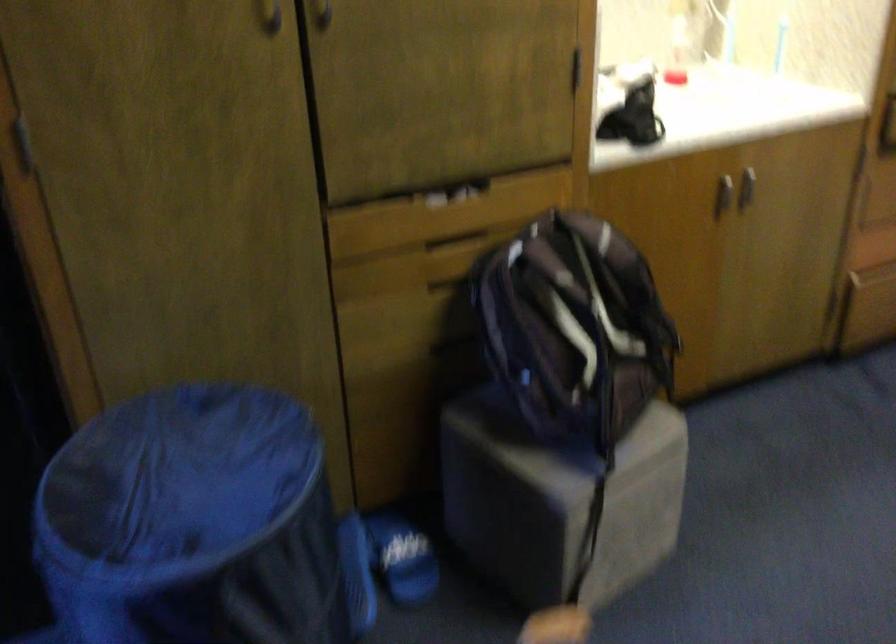
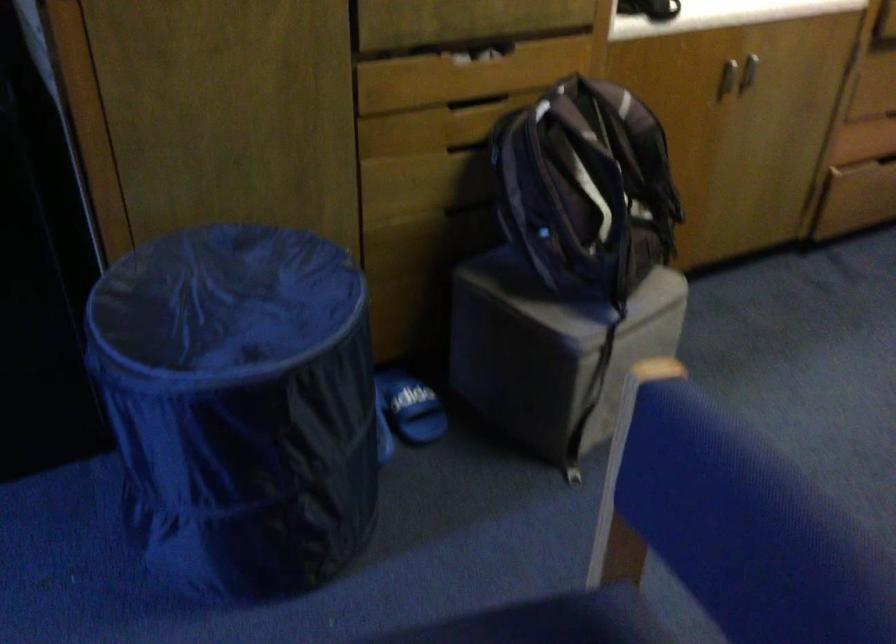
The point at (455, 243) is marked in the first image. Where is the corresponding point in the second image?

(476, 102)